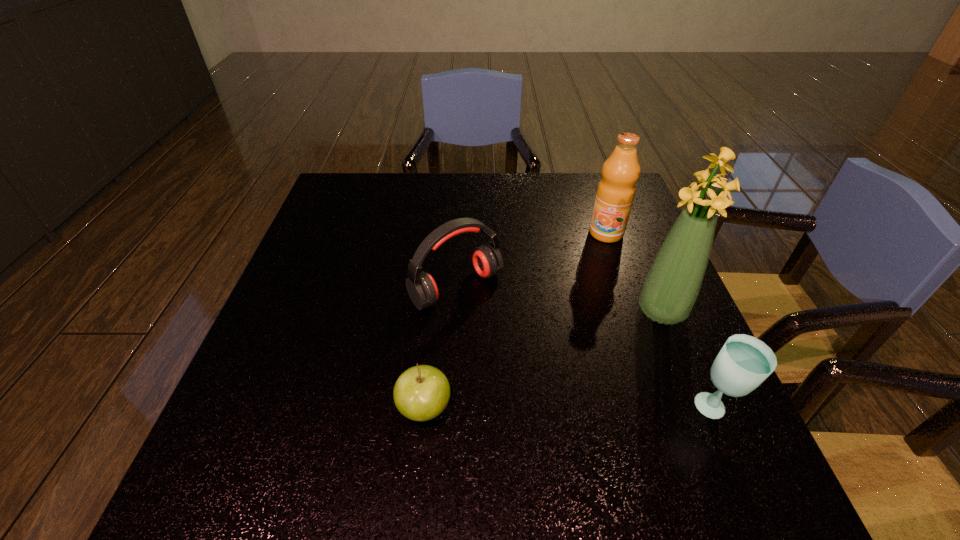
Identify the location of free region located on the front label of the fourth shortest object. (587, 284).

I want to click on free space located on the front-facing side of the bouquet, so point(515,432).

The image size is (960, 540). Identify the location of free space located 0.210m on the front-facing side of the bouquet. (585, 375).

You are a GUI agent. You are given a task and a screenshot of the screen. Output one action in this format:
    pyautogui.click(x=<x>, y=<y>)
    Task: Click on the vacant space located on the front-facing side of the bouquet
    Image resolution: width=960 pixels, height=540 pixels.
    Given the screenshot: What is the action you would take?
    pyautogui.click(x=578, y=380)

Where is `free space located 0.080m on the ear cups of the earphone`? This screenshot has height=540, width=960. free space located 0.080m on the ear cups of the earphone is located at coordinates (505, 334).

Where is `vacant space situated 0.150m on the ear cups of the earphone`? The image size is (960, 540). vacant space situated 0.150m on the ear cups of the earphone is located at coordinates (525, 356).

Locate an element on the screen. This screenshot has height=540, width=960. free space located 0.130m on the ear cups of the earphone is located at coordinates (519, 349).

At what (x,y) coordinates should I click in order to perform the action: click on apple present at the near edge. Please return your answer as a coordinate pair (x, y). The height and width of the screenshot is (540, 960). Looking at the image, I should click on (421, 393).

Where is `glass located at the near edge`? glass located at the near edge is located at coordinates (744, 362).

Locate an element on the screen. The image size is (960, 540). glass situated at the right edge is located at coordinates pyautogui.click(x=744, y=362).